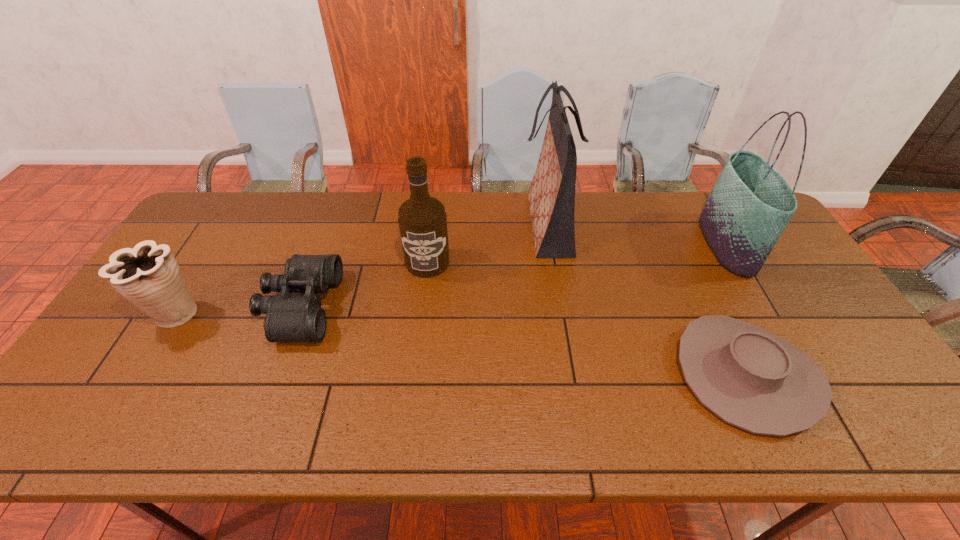
This screenshot has width=960, height=540. In order to click on vacant region located 0.260m on the front-facing side of the shopping bag in this screenshot , I will do `click(443, 224)`.

Where is `vacant area situated on the front-facing side of the shopping bag`? vacant area situated on the front-facing side of the shopping bag is located at coordinates click(x=443, y=224).

You are a GUI agent. You are given a task and a screenshot of the screen. Output one action in this format:
    pyautogui.click(x=<x>, y=<y>)
    Task: Click on the free space located on the back of the tote bag
    This screenshot has height=540, width=960.
    Given the screenshot: What is the action you would take?
    pyautogui.click(x=697, y=192)

Find the location of a particular element. The width and height of the screenshot is (960, 540). blank area located 0.390m on the label of the alcohol is located at coordinates (412, 398).

Locate an element on the screen. This screenshot has width=960, height=540. vacant position located 0.170m on the right of the fourth tallest object is located at coordinates (264, 315).

Identify the location of vacant position located 0.080m at the eyepieces of the second shortest object. (363, 306).

Find the location of `vacant space located 0.100m on the back of the shortest object`. vacant space located 0.100m on the back of the shortest object is located at coordinates (707, 293).

Where is `shopping bag located in the far edge section of the desktop`? The image size is (960, 540). shopping bag located in the far edge section of the desktop is located at coordinates (551, 196).

The height and width of the screenshot is (540, 960). In order to click on tote bag that is at the far edge in this screenshot , I will do `click(750, 204)`.

Identify the location of object that is at the near edge. (750, 378).